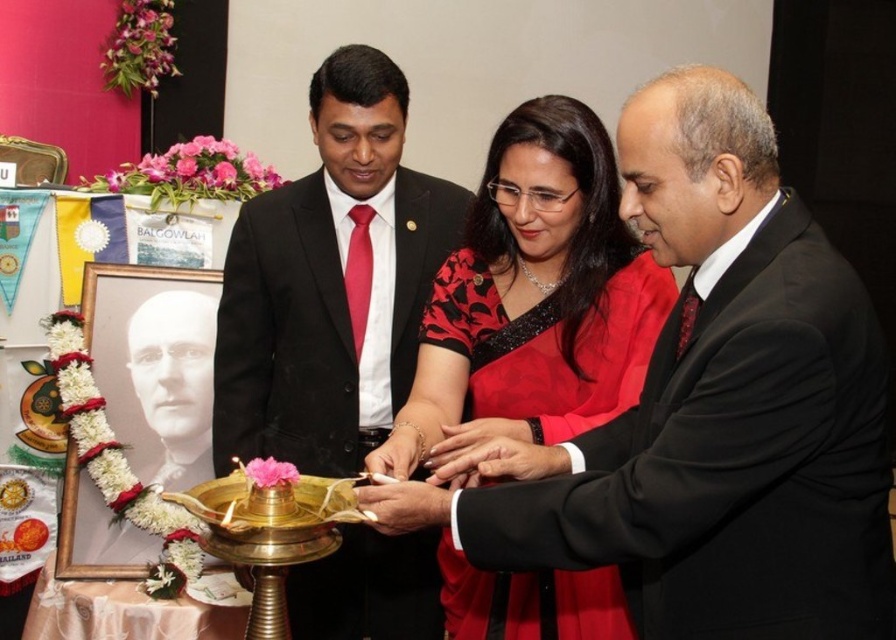
Who is taller, shiny black dress at center or black satin saree at center?

Answer: Standing taller between the two is shiny black dress at center.

Who is higher up, shiny black dress at center or black satin saree at center?

black satin saree at center is above.

Between point (742, 260) and point (503, 129), which one is positioned behind?

Point (503, 129)

Find the location of a particular element. The height and width of the screenshot is (640, 896). shiny black dress at center is located at coordinates (709, 410).

Is shiny black dress at center positioned at the back of matte black suit at center?

No, it is in front of matte black suit at center.

Between shiny black dress at center and matte black suit at center, which one has less height?

With less height is shiny black dress at center.

Is point (536, 444) positioned behind point (359, 77)?

No, it is not.

Find the location of a particular element. shiny black dress at center is located at coordinates (709, 410).

Which of these two, matte black suit at center or black satin saree at center, stands shorter?

black satin saree at center is shorter.

Is point (313, 220) positioned in front of point (464, 628)?

That is False.

Find the location of a particular element. matte black suit at center is located at coordinates (332, 282).